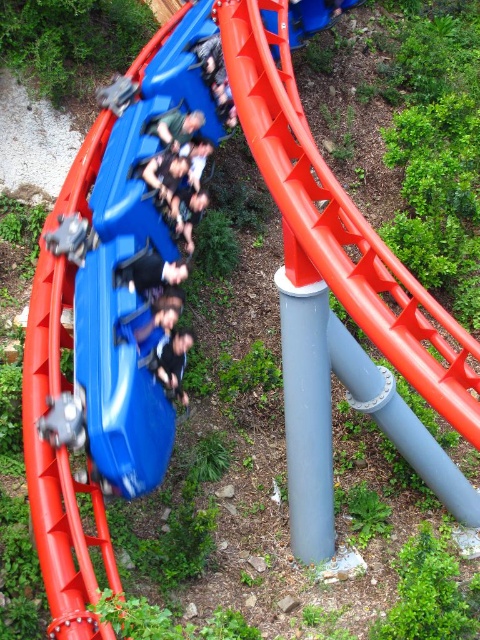
Question: Is dark blue fabric at center wider than black matte gloves at center?

Choices:
 (A) yes
 (B) no

Answer: (B)

Question: Which object is farther from the camera taking this photo?

Choices:
 (A) smooth orange slide at center
 (B) dark blue fabric at center

Answer: (B)

Question: Can you confirm if matte black seats at center is thinner than black matte gloves at center?

Choices:
 (A) no
 (B) yes

Answer: (A)

Question: Which point is closer to the camera?

Choices:
 (A) (399, 276)
 (B) (175, 349)
 (C) (180, 166)

Answer: (A)

Question: Which object appears farthest from the camera in this image?

Choices:
 (A) black matte gloves at center
 (B) matte black seats at center

Answer: (B)

Question: Does matte black seats at center have a smaller size compared to black matte gloves at center?

Choices:
 (A) yes
 (B) no

Answer: (B)